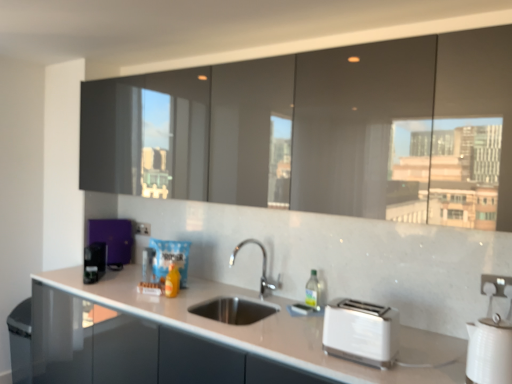
At what (x,y) coordinates should I click in order to perform the action: click on free point to the left of white plastic toaster at lower right. Please return your answer as a coordinate pair (x, y). Image resolution: width=512 pixels, height=384 pixels. Looking at the image, I should click on (301, 350).